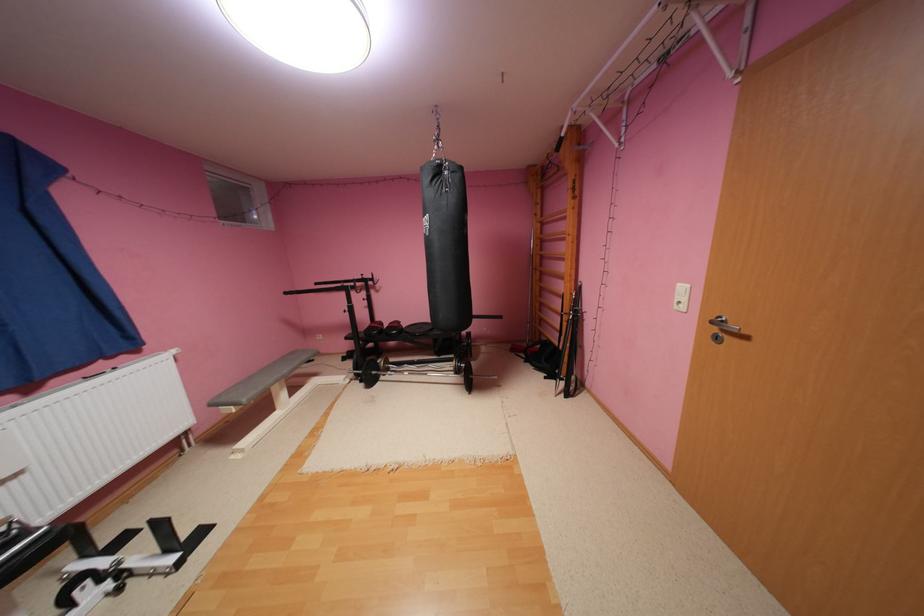
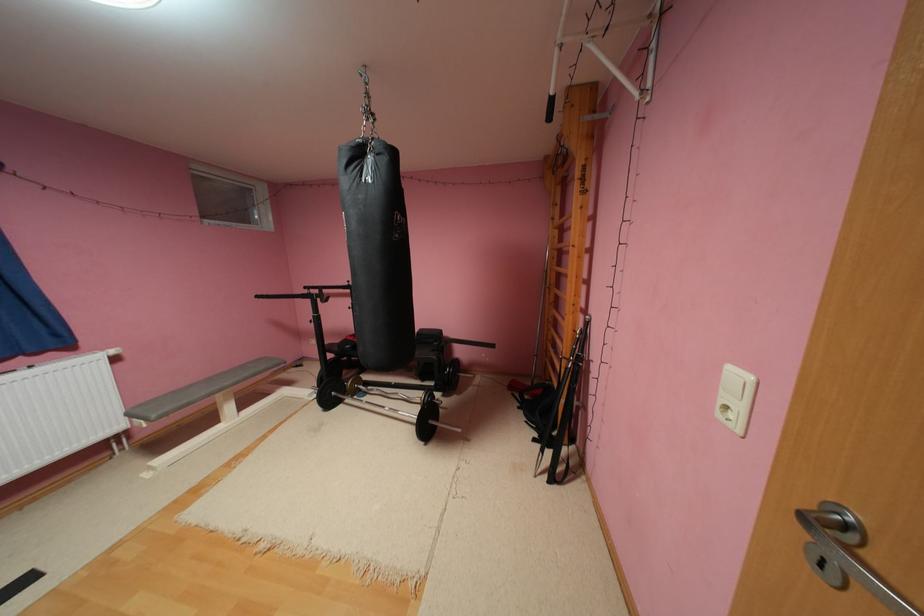
Which direction would the cameraman need to move to produce the second image?

The cameraman moved toward right, forward.